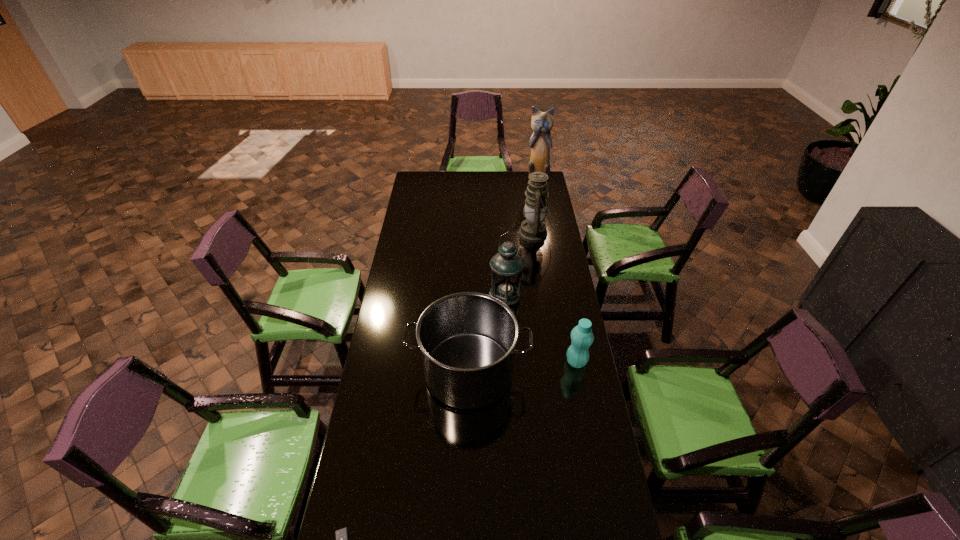
At what (x,y) coordinates should I click in order to perform the action: click on vacant area situated 0.330m on the front of the farther oil lamp. Please return your answer as a coordinate pair (x, y). This screenshot has height=540, width=960. Looking at the image, I should click on (543, 292).

Image resolution: width=960 pixels, height=540 pixels. I want to click on free location located on the back of the saucepan, so click(x=470, y=310).

Image resolution: width=960 pixels, height=540 pixels. I want to click on free space located 0.310m on the left of the bottle, so click(489, 362).

Where is `object that is at the far edge`? object that is at the far edge is located at coordinates (542, 122).

Where is `object at the left edge`? The height and width of the screenshot is (540, 960). object at the left edge is located at coordinates (467, 340).

Where is `cat situated at the right edge`? The image size is (960, 540). cat situated at the right edge is located at coordinates (542, 122).

Identify the location of oil lamp that is at the right edge. (533, 229).

Identify the location of bottle situated at the right edge. (582, 337).

This screenshot has width=960, height=540. Identify the location of object that is positioned at the far right corner. (542, 122).

I want to click on free point at the far edge, so click(487, 178).